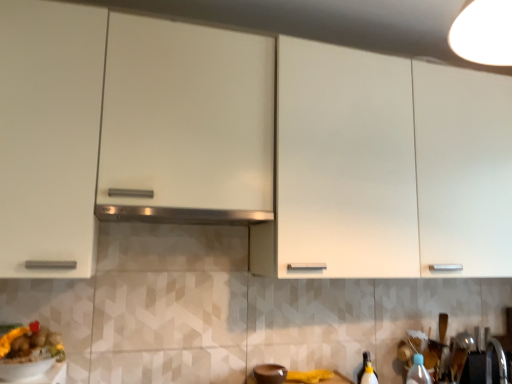
Question: From a real-world perspective, is white glossy cabinet at upper center above or below satin silver exhaust hood at center?

Choices:
 (A) above
 (B) below

Answer: (A)

Question: Does point (336, 119) appear closer or farther from the camera than point (117, 215)?

Choices:
 (A) closer
 (B) farther

Answer: (B)

Question: Which object is the closest to the transparent plastic sink at lower right, the first sink when ordered from left to right?

Choices:
 (A) translucent plastic bottle at lower right
 (B) white glossy cabinet at upper center
 (C) transparent plastic sink at lower right, which is counted as the first sink, starting from the right
 (D) yellow matte food at lower left
 (E) satin silver exhaust hood at center

Answer: (C)

Question: Based on their relative distances, which object is nearer to the translucent plastic bottle at lower right?

Choices:
 (A) yellow matte food at lower left
 (B) satin silver exhaust hood at center
 (C) brown matte bowl at lower center
 (D) transparent plastic sink at lower right, which is the 2th sink in left-to-right order
 (E) transparent plastic sink at lower right, the first sink when ordered from left to right

Answer: (E)